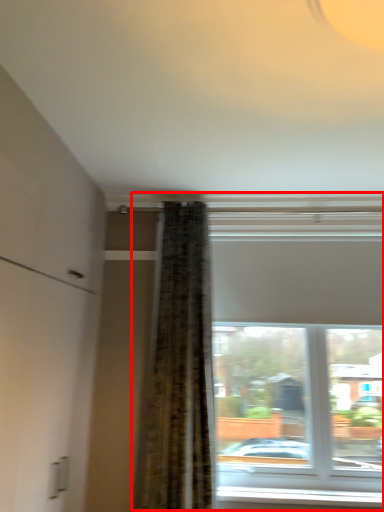
Question: From the image's perspective, what is the correct spatial positioning of window (annotated by the red box) in reference to window sill?

Choices:
 (A) above
 (B) below

Answer: (A)